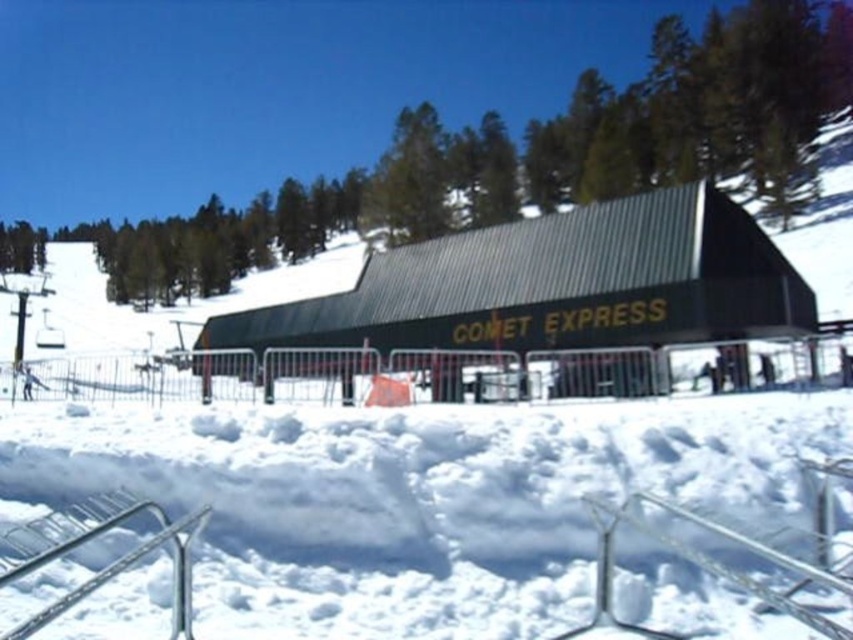
Does white fluffy snow at center have a smaller size compared to metallic green building at center?

Correct, white fluffy snow at center occupies less space than metallic green building at center.

Is white fluffy snow at center wider than metallic green building at center?

In fact, white fluffy snow at center might be narrower than metallic green building at center.

Find the location of a particular element. white fluffy snow at center is located at coordinates (421, 499).

Is white fluffy snow at center taller than metallic silver rail at lower center?

Yes, white fluffy snow at center is taller than metallic silver rail at lower center.

Can you confirm if white fluffy snow at center is positioned below metallic silver rail at lower center?

Incorrect, white fluffy snow at center is not positioned below metallic silver rail at lower center.

The image size is (853, 640). Describe the element at coordinates (421, 499) in the screenshot. I see `white fluffy snow at center` at that location.

Find the location of `white fluffy snow at center`. white fluffy snow at center is located at coordinates (421, 499).

Between point (160, 516) and point (602, 522), which one is positioned in front?

Point (160, 516) is more forward.

Is metallic silver rail at lower left behind metallic silver rail at lower center?

Yes, it is.

Does point (35, 618) lie behind point (671, 540)?

No, it is not.

Image resolution: width=853 pixels, height=640 pixels. Find the location of `metallic silver rail at lower left`. metallic silver rail at lower left is located at coordinates (111, 563).